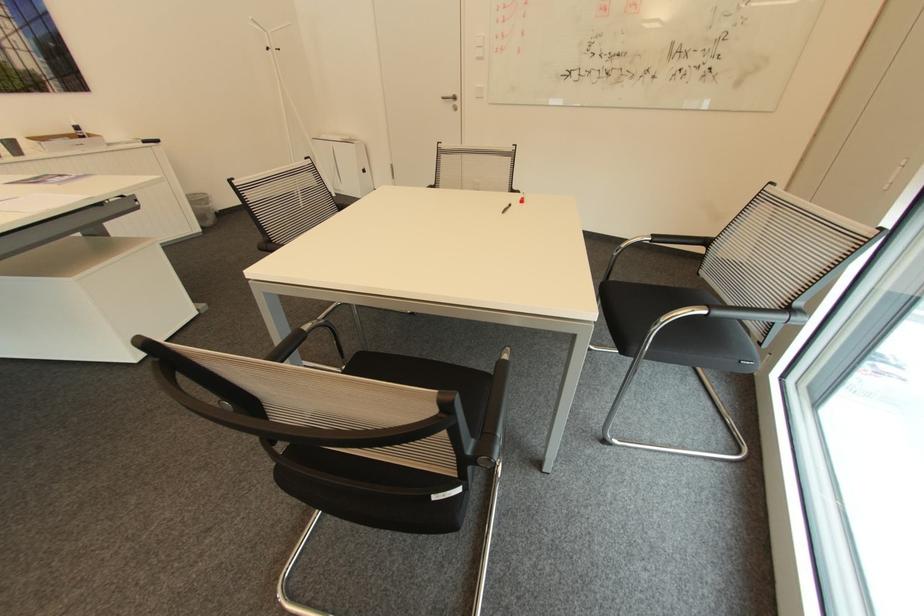
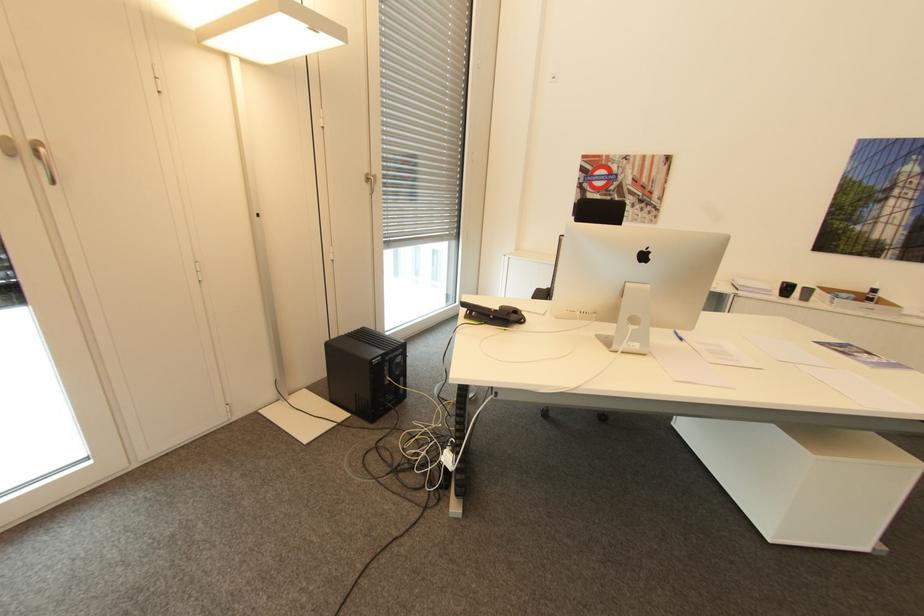
In the second image, find the point that corresponds to [81,128] in the first image.

(879, 290)